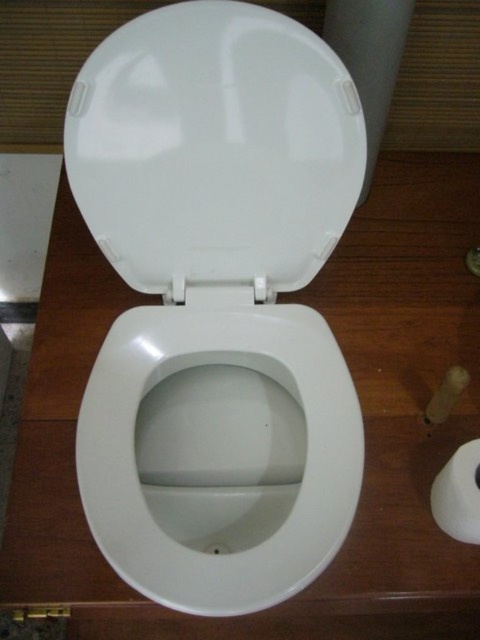
Which is in front, point (273, 444) or point (447, 461)?

Positioned in front is point (447, 461).

Locate an element on the screen. The width and height of the screenshot is (480, 640). white glossy toilet bowl at center is located at coordinates (219, 452).

Does point (309, 321) come farther from viewer compared to point (74, 113)?

Yes, point (309, 321) is behind point (74, 113).

Is point (163, 557) behind point (338, 132)?

No.

I want to click on white glossy toilet bowl at center, so click(219, 452).

Can you confirm if white glossy toilet at center is positioned to the right of white glossy toilet bowl at center?

No, white glossy toilet at center is not to the right of white glossy toilet bowl at center.

Who is positioned more to the left, white glossy toilet at center or white glossy toilet bowl at center?

white glossy toilet at center

Which is behind, point (328, 401) or point (82, 456)?

Point (328, 401)

Locate an element on the screen. The height and width of the screenshot is (640, 480). white glossy toilet at center is located at coordinates (216, 301).